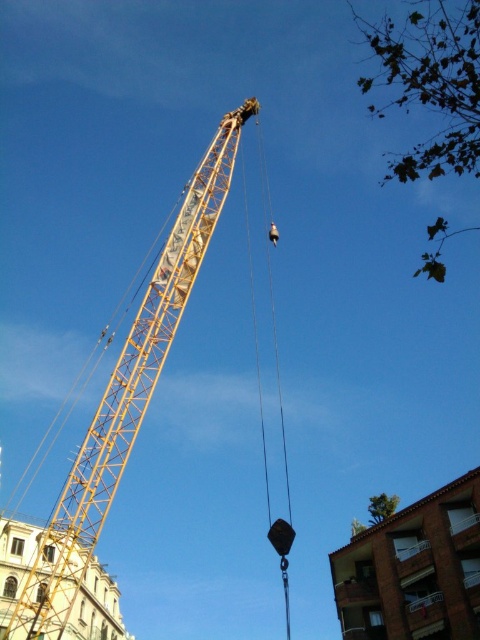
Does yellow metallic crane at center appear on the left side of black rubber lift at center?

Indeed, yellow metallic crane at center is positioned on the left side of black rubber lift at center.

Who is positioned more to the left, yellow metallic crane at center or black rubber lift at center?

Positioned to the left is yellow metallic crane at center.

Between point (88, 452) and point (282, 532), which one is positioned in front?

Point (88, 452)

Where is `yellow metallic crane at center`? yellow metallic crane at center is located at coordinates (126, 397).